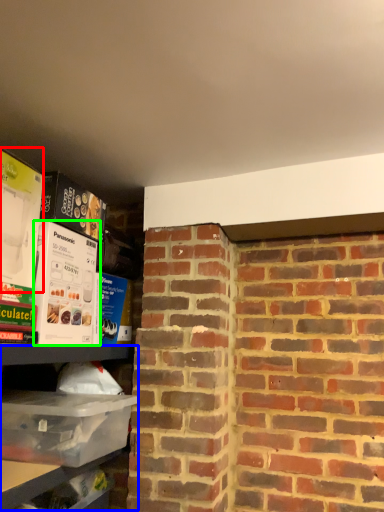
Question: Which object is the closest to the box (highlighted by a red box)? Choose among these: shelf (highlighted by a blue box) or box (highlighted by a green box).

Choices:
 (A) shelf
 (B) box

Answer: (B)